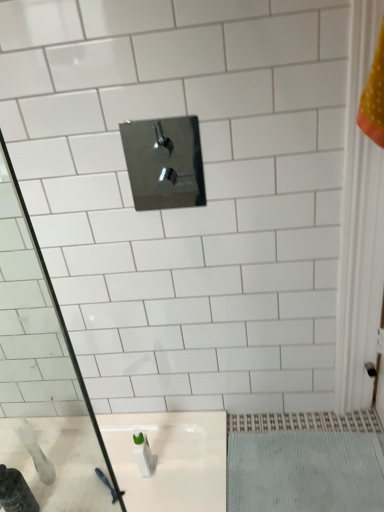
Question: Is white textured bath mat at lower right a part of polished chrome tap at upper center?

Choices:
 (A) no
 (B) yes

Answer: (A)

Question: Is the depth of polished chrome tap at upper center less than that of white textured bath mat at lower right?

Choices:
 (A) no
 (B) yes

Answer: (B)

Question: From a real-world perspective, is polished chrome tap at upper center below white textured bath mat at lower right?

Choices:
 (A) no
 (B) yes

Answer: (A)

Question: Is white textured bath mat at lower right at the back of polished chrome tap at upper center?

Choices:
 (A) no
 (B) yes

Answer: (A)

Question: Are polished chrome tap at upper center and white textured bath mat at lower right far apart?

Choices:
 (A) yes
 (B) no

Answer: (A)

Question: Does polished chrome tap at upper center appear on the right side of white textured bath mat at lower right?

Choices:
 (A) yes
 (B) no

Answer: (B)

Question: Is white glossy bottle at lower left at the left side of polished chrome tap at upper center?

Choices:
 (A) yes
 (B) no

Answer: (A)

Question: Is white glossy bottle at lower left positioned beyond the bounds of polished chrome tap at upper center?

Choices:
 (A) no
 (B) yes

Answer: (B)

Question: Is white glossy bottle at lower left next to polished chrome tap at upper center and touching it?

Choices:
 (A) yes
 (B) no

Answer: (B)

Question: Considering the relative sizes of white glossy bottle at lower left and polished chrome tap at upper center in the image provided, is white glossy bottle at lower left bigger than polished chrome tap at upper center?

Choices:
 (A) no
 (B) yes

Answer: (A)

Question: From the image's perspective, is white glossy bottle at lower left below polished chrome tap at upper center?

Choices:
 (A) no
 (B) yes

Answer: (B)

Question: Can you confirm if white glossy bottle at lower left is wider than polished chrome tap at upper center?

Choices:
 (A) no
 (B) yes

Answer: (B)

Question: From a real-world perspective, is polished chrome tap at upper center physically above white glossy bottle at lower left?

Choices:
 (A) no
 (B) yes

Answer: (B)